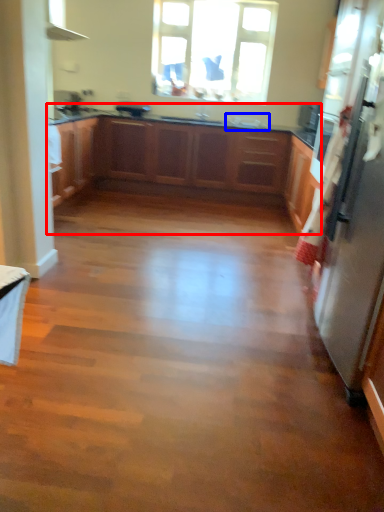
Question: Among these objects, which one is nearest to the camera, cabinetry (highlighted by a red box) or sink (highlighted by a blue box)?

Choices:
 (A) cabinetry
 (B) sink

Answer: (A)